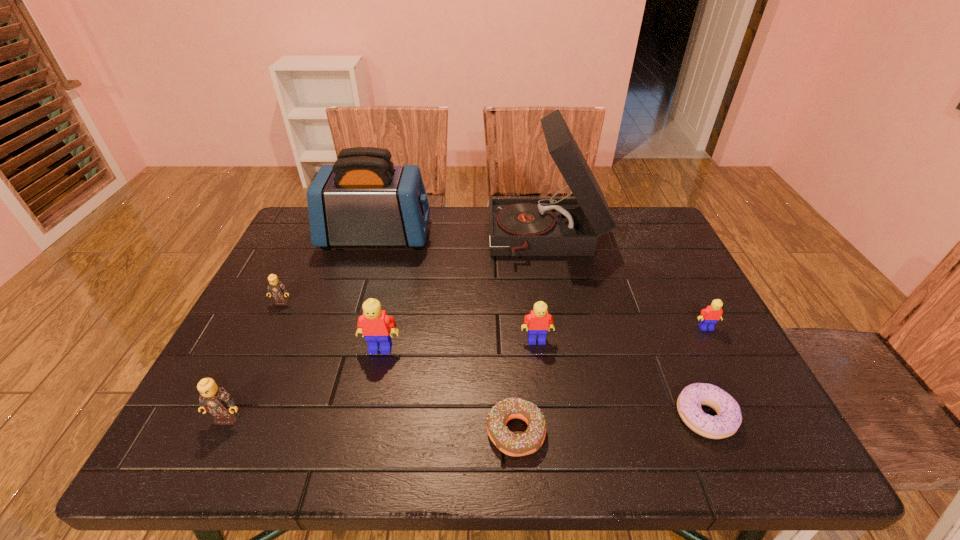
At what (x,y) coordinates should I click in order to perform the action: click on toaster situated at the left edge. Please return your answer as a coordinate pair (x, y). Looking at the image, I should click on (363, 199).

Find the location of `Lego that is at the right edge`. Lego that is at the right edge is located at coordinates (709, 316).

Find the location of a particular element. The width and height of the screenshot is (960, 540). doughnut at the right edge is located at coordinates (727, 421).

Where is `object at the far left corner`? object at the far left corner is located at coordinates (363, 199).

This screenshot has width=960, height=540. What are the coordinates of `object located at the near left corner` in the screenshot? It's located at (214, 399).

You are a GUI agent. You are given a task and a screenshot of the screen. Output one action in this format:
    pyautogui.click(x=<x>, y=<y>)
    Task: Click on the object situated at the near right corner
    
    Given the screenshot: What is the action you would take?
    pyautogui.click(x=727, y=421)

The image size is (960, 540). I want to click on free space at the far edge, so click(x=481, y=206).

The height and width of the screenshot is (540, 960). In the image, there is a desktop. What are the coordinates of `vacant area at the near edge` in the screenshot? It's located at point(486,435).

I want to click on free space at the left edge of the desktop, so click(248, 408).

The width and height of the screenshot is (960, 540). I want to click on vacant space at the right edge, so click(760, 414).